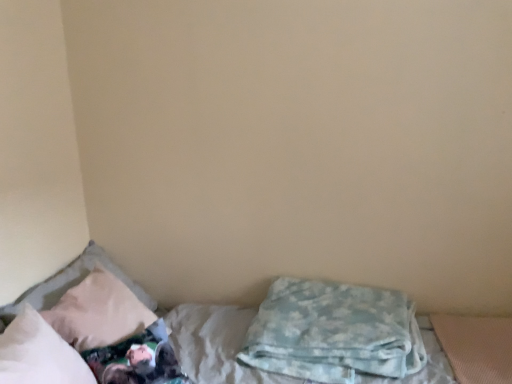
Question: From a real-world perspective, relative to white soft bed at lower left, is beige fabric pillow at left, which appears as the second pillow when viewed from the right, vertically above or below?

Choices:
 (A) below
 (B) above

Answer: (B)

Question: Is point (39, 309) closer or farther from the camera than point (493, 357)?

Choices:
 (A) closer
 (B) farther

Answer: (A)

Question: Which is farther from the beige fabric pillow at left, positioned as the second pillow in left-to-right order?

Choices:
 (A) white soft pillow at left, arranged as the first pillow when viewed from the left
 (B) white soft bed at lower left
 (C) blue soft blanket at lower right, placed as the 1th pillow when sorted from right to left

Answer: (C)

Question: Which of these objects is positioned closest to the blue soft blanket at lower right, acting as the 3th pillow starting from the left?

Choices:
 (A) beige fabric pillow at left, positioned as the second pillow in left-to-right order
 (B) white soft pillow at left, arranged as the first pillow when viewed from the left
 (C) white soft bed at lower left

Answer: (C)